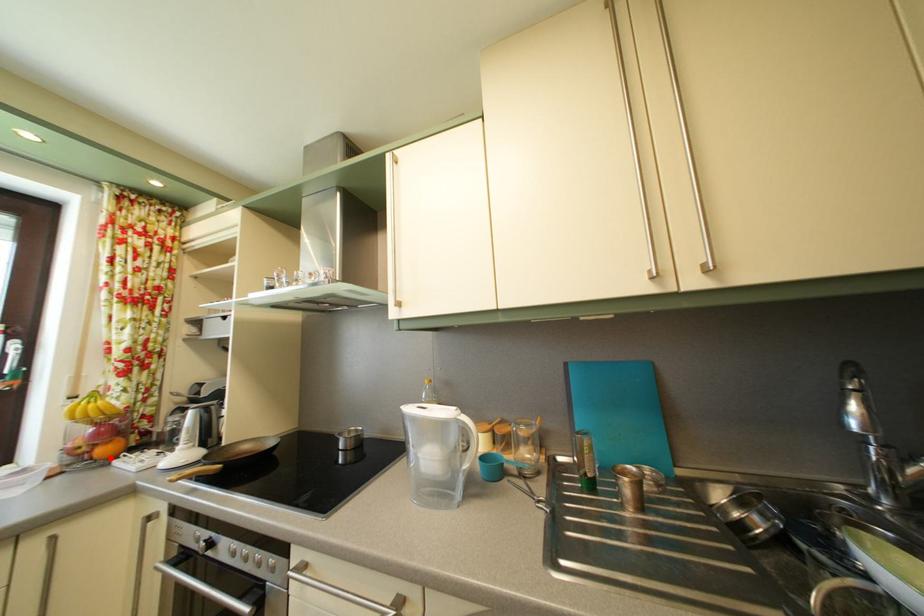
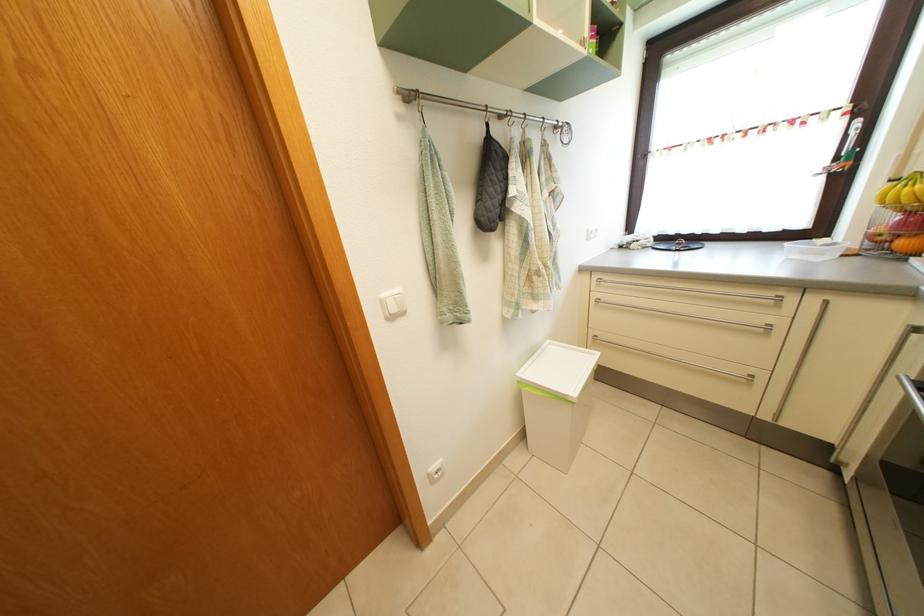
The point at the highlighted location is marked in the first image. Where is the corresponding point in the second image?

(910, 252)